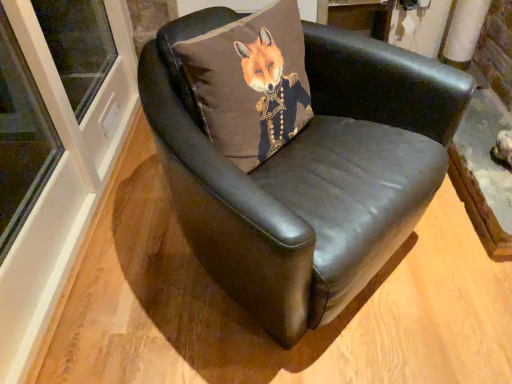
Question: In the image, is brown fabric pillow at center positioned in front of or behind black leather chair at center?

Choices:
 (A) behind
 (B) front

Answer: (A)

Question: Considering the positions of brown fabric pillow at center and black leather chair at center in the image, is brown fabric pillow at center wider or thinner than black leather chair at center?

Choices:
 (A) thin
 (B) wide

Answer: (A)

Question: From a real-world perspective, is brown fabric pillow at center physically located above or below black leather chair at center?

Choices:
 (A) above
 (B) below

Answer: (A)

Question: Is black leather chair at center in front of or behind brown fabric pillow at center in the image?

Choices:
 (A) front
 (B) behind

Answer: (A)

Question: From their relative heights in the image, would you say black leather chair at center is taller or shorter than brown fabric pillow at center?

Choices:
 (A) tall
 (B) short

Answer: (A)

Question: From a real-world perspective, is black leather chair at center positioned above or below brown fabric pillow at center?

Choices:
 (A) above
 (B) below

Answer: (B)

Question: Is point (368, 193) positioned closer to the camera than point (237, 122)?

Choices:
 (A) farther
 (B) closer

Answer: (B)